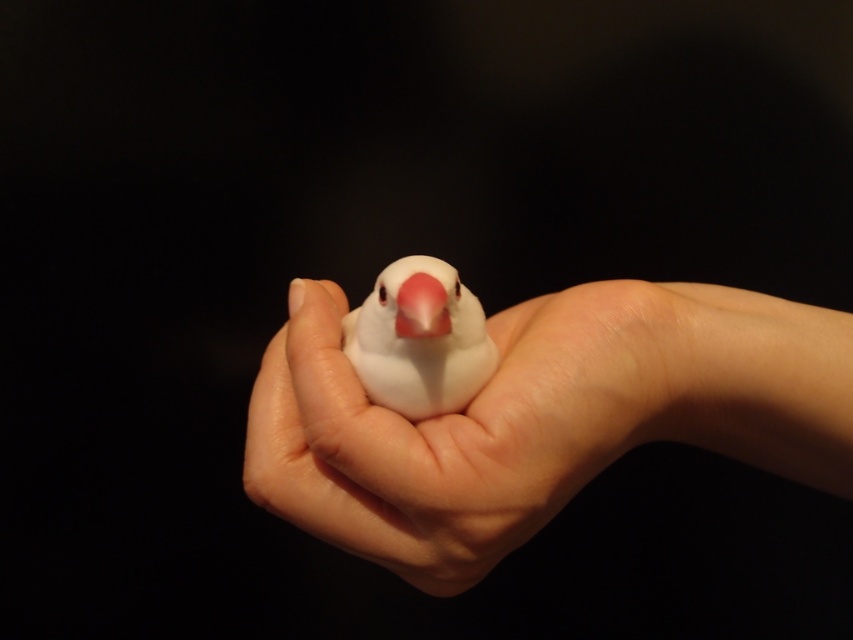
Is white matte bird at center taller than pink matte beak at center?

Yes.

What do you see at coordinates (419, 339) in the screenshot? This screenshot has height=640, width=853. I see `white matte bird at center` at bounding box center [419, 339].

Who is more forward, (x=473, y=337) or (x=398, y=332)?

Positioned in front is point (x=398, y=332).

The height and width of the screenshot is (640, 853). I want to click on white matte bird at center, so click(x=419, y=339).

Describe the element at coordinates (473, 426) in the screenshot. Image resolution: width=853 pixels, height=640 pixels. I see `smooth skin hand at center` at that location.

Is smooth skin hand at center above white matte bird at center?

No, smooth skin hand at center is not above white matte bird at center.

This screenshot has height=640, width=853. I want to click on smooth skin hand at center, so click(473, 426).

I want to click on smooth skin hand at center, so (x=473, y=426).

Can you confirm if smooth skin hand at center is positioned below pink matte beak at center?

Indeed, smooth skin hand at center is positioned under pink matte beak at center.

Who is shorter, smooth skin hand at center or pink matte beak at center?

With less height is pink matte beak at center.

Between point (561, 394) and point (413, 324), which one is positioned in front?

Point (413, 324) is in front.

Locate an element on the screen. The width and height of the screenshot is (853, 640). smooth skin hand at center is located at coordinates (473, 426).